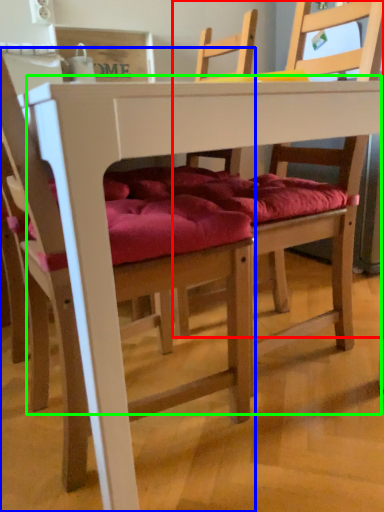
Question: Estimate the real-world distances between objects in this image. Which object is farther from chair (highlighted by a red box), chair (highlighted by a blue box) or table (highlighted by a green box)?

Choices:
 (A) chair
 (B) table

Answer: (B)